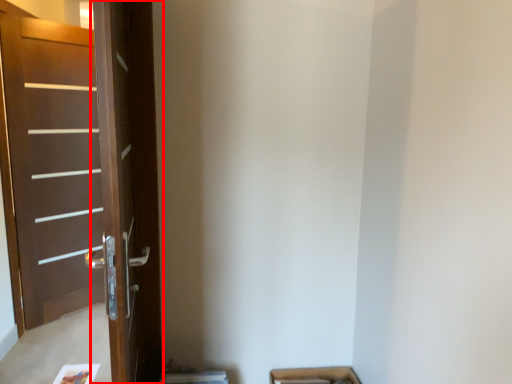
Question: From the image, what is the correct spatial relationship of screen door (annotated by the red box) in relation to door?

Choices:
 (A) right
 (B) left

Answer: (A)